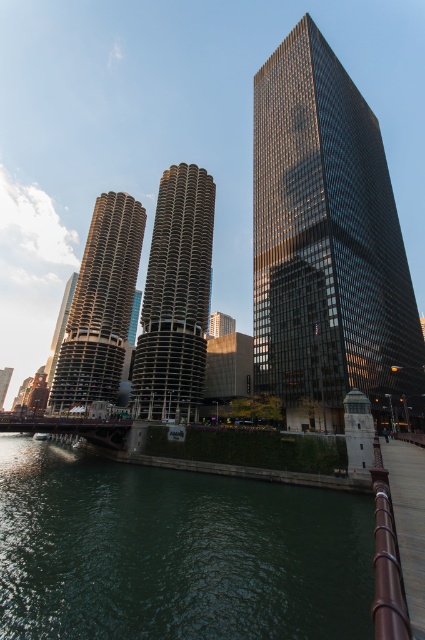
You are standing at the edge of the river in the urban scene and want to reach a point marked by point (8, 381) and point (45, 436). Which point is closer to you?

Point (8, 381) is closer to you because it is further to the viewer than point (45, 436).

You are standing at the edge of the green water at lower left and want to throw a pebble to reach the base of the rectangular building with dark facade. Given that the distance between you and the building is 20 meters, will the pebble be able to reach the building if you can throw it 18 meters?

The green water at lower left is 16.92 meters away from the viewer. Since the rectangular building with dark facade is 20 meters away, the pebble can only reach 18 meters, which is not enough to reach the building. Therefore, the pebble will not reach the base of the rectangular building with dark facade.

You are a drone operator trying to capture a photo of the glossy glass skyscraper at upper center. Your drone is currently at coordinates point 0.380, 0.769. Is the drone positioned directly above the skyscraper?

Yes, the glossy glass skyscraper at upper center is located at point (326, 243), so the drone is positioned directly above it.